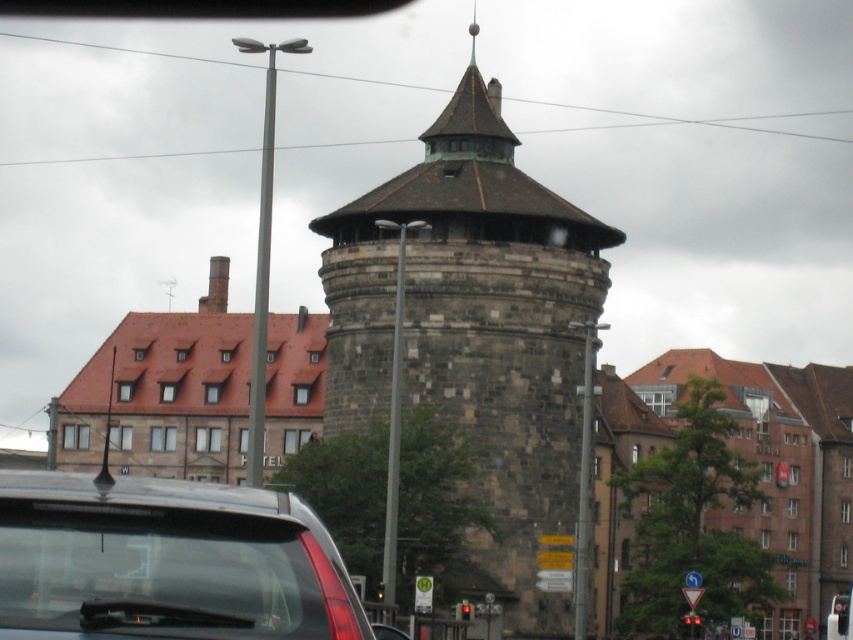
In the scene shown: Who is taller, brown stone tower at center or transparent glass car at lower left?

With more height is brown stone tower at center.

Can you confirm if brown stone tower at center is shorter than transparent glass car at lower left?

In fact, brown stone tower at center may be taller than transparent glass car at lower left.

Between point (532, 291) and point (177, 627), which one is positioned behind?

The point (532, 291) is behind.

Find the location of a particular element. The height and width of the screenshot is (640, 853). brown stone tower at center is located at coordinates (474, 323).